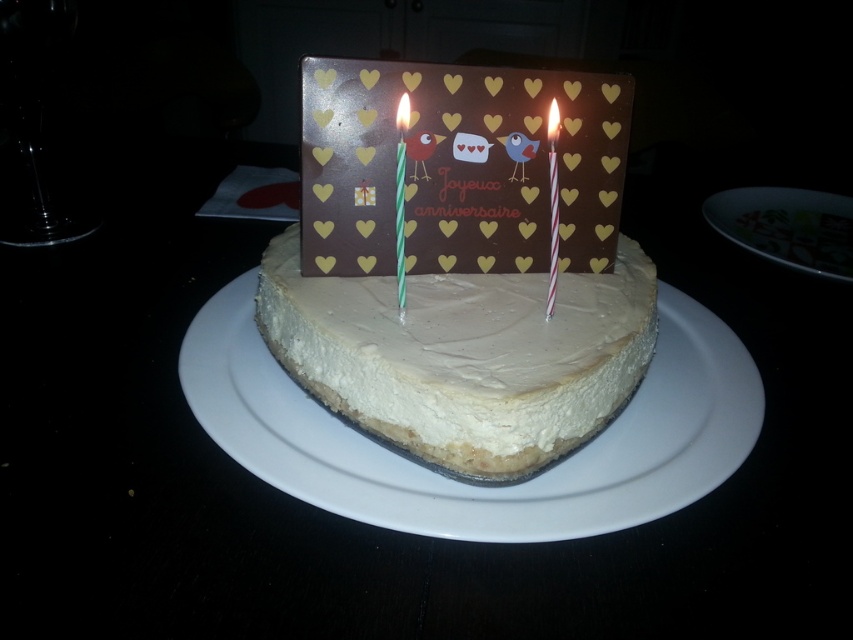
Is brown paper card at center further to the viewer compared to white glossy plate at upper right?

No, brown paper card at center is closer to the viewer.

Does point (376, 68) lie in front of point (741, 198)?

Yes.

The width and height of the screenshot is (853, 640). Identify the location of brown paper card at center. (457, 168).

Consider the image. Which is more to the right, white glossy plate at upper right or white striped paper at center?

white glossy plate at upper right is more to the right.

The image size is (853, 640). Identify the location of white glossy plate at upper right. (787, 227).

Who is higher up, white cream cheese cake at center or white wax candle at upper center?

white wax candle at upper center

Which is behind, point (479, 230) or point (555, 262)?

Point (479, 230)

Where is `white cream cheese cake at center`? This screenshot has height=640, width=853. white cream cheese cake at center is located at coordinates (462, 262).